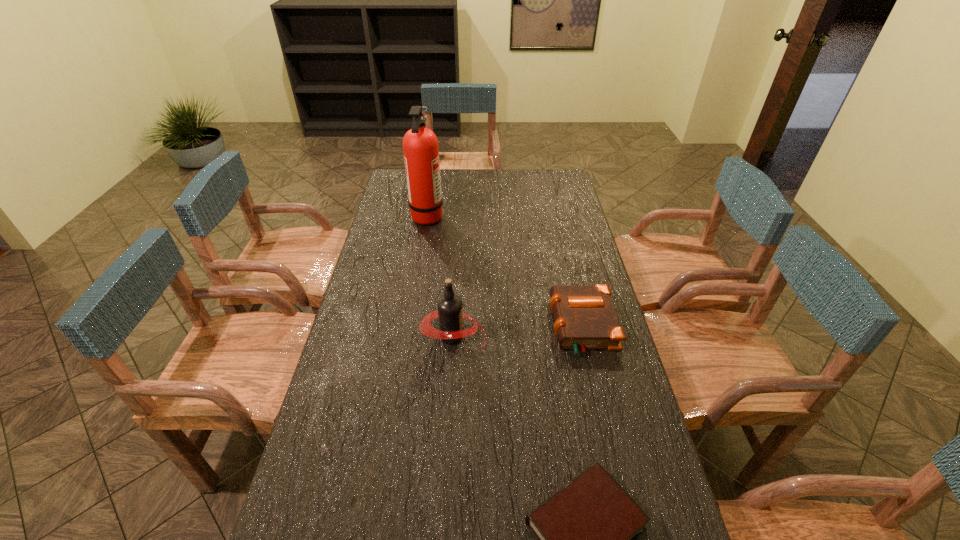
At what (x,y) coordinates should I click in order to perform the action: click on free space that is in between the third shortest object and the farther Bible. Please return your answer as a coordinate pair (x, y). This screenshot has width=960, height=540. Looking at the image, I should click on (517, 331).

Select which object is the closest to the root beer. Please provide its 2D coordinates. Your answer should be formatted as a tuple, i.e. [(x, y)], where the tuple contains the x and y coordinates of a point satisfying the conditions above.

[(585, 318)]

The height and width of the screenshot is (540, 960). Identify the location of object that can be found as the second closest to the farther Bible. (586, 532).